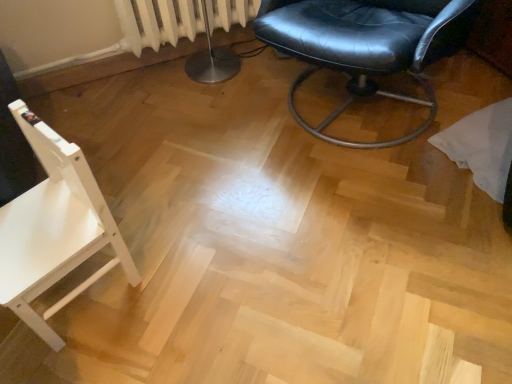
Question: Does black leather chair at center, the 1th chair when ordered from right to left, have a lesser height compared to white wood chair at left, arranged as the second chair when viewed from the top?

Choices:
 (A) no
 (B) yes

Answer: (A)

Question: Is black leather chair at center, which appears as the 2th chair when viewed from the left, bigger than white wood chair at left, the first chair in the bottom-to-top sequence?

Choices:
 (A) yes
 (B) no

Answer: (A)

Question: Is black leather chair at center, the 1th chair when ordered from right to left, not within white wood chair at left, the first chair in the left-to-right sequence?

Choices:
 (A) yes
 (B) no

Answer: (A)

Question: From the image's perspective, is black leather chair at center, the second chair ordered from the bottom, under white wood chair at left, positioned as the 2th chair in right-to-left order?

Choices:
 (A) yes
 (B) no

Answer: (B)

Question: Does black leather chair at center, the second chair ordered from the bottom, have a smaller size compared to white wood chair at left, arranged as the second chair when viewed from the top?

Choices:
 (A) yes
 (B) no

Answer: (B)

Question: From a real-world perspective, is white wood chair at left, positioned as the 2th chair in right-to-left order, above or below white textured radiator at upper left?

Choices:
 (A) below
 (B) above

Answer: (A)

Question: Is white wood chair at left, arranged as the second chair when viewed from the top, taller or shorter than white textured radiator at upper left?

Choices:
 (A) tall
 (B) short

Answer: (A)

Question: From the image's perspective, is white wood chair at left, the first chair in the left-to-right sequence, positioned above or below white textured radiator at upper left?

Choices:
 (A) above
 (B) below

Answer: (B)

Question: Is white wood chair at left, arranged as the second chair when viewed from the top, in front of or behind white textured radiator at upper left in the image?

Choices:
 (A) front
 (B) behind

Answer: (A)

Question: In terms of width, does white textured radiator at upper left look wider or thinner when compared to black leather chair at center, which appears as the 1th chair when viewed from the top?

Choices:
 (A) wide
 (B) thin

Answer: (B)

Question: Does point (153, 21) appear closer or farther from the camera than point (387, 67)?

Choices:
 (A) farther
 (B) closer

Answer: (A)

Question: From a real-world perspective, is white textured radiator at upper left above or below black leather chair at center, the 1th chair when ordered from right to left?

Choices:
 (A) above
 (B) below

Answer: (B)

Question: Is white textured radiator at upper left taller or shorter than black leather chair at center, which appears as the 1th chair when viewed from the top?

Choices:
 (A) short
 (B) tall

Answer: (A)

Question: In terms of width, does black leather chair at center, which appears as the 2th chair when viewed from the left, look wider or thinner when compared to white wood chair at left, the first chair in the left-to-right sequence?

Choices:
 (A) wide
 (B) thin

Answer: (A)

Question: Is black leather chair at center, which appears as the 2th chair when viewed from the left, taller or shorter than white wood chair at left, the first chair in the left-to-right sequence?

Choices:
 (A) tall
 (B) short

Answer: (A)